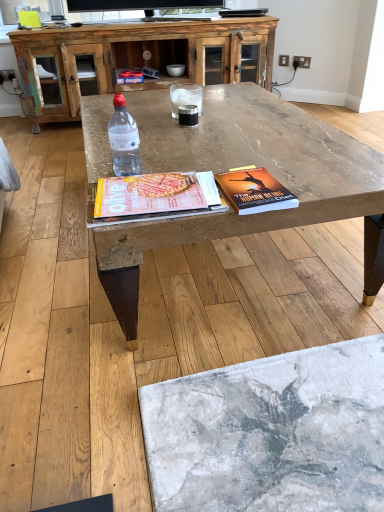
Question: From the image's perspective, does marble textured coffee table at center appear higher than clear glass at center?

Choices:
 (A) no
 (B) yes

Answer: (A)

Question: From a real-world perspective, does marble textured coffee table at center stand above clear glass at center?

Choices:
 (A) no
 (B) yes

Answer: (A)

Question: Is there a large distance between marble textured coffee table at center and clear glass at center?

Choices:
 (A) yes
 (B) no

Answer: (B)

Question: Can you confirm if marble textured coffee table at center is wider than clear glass at center?

Choices:
 (A) yes
 (B) no

Answer: (A)

Question: Is marble textured coffee table at center at the left side of clear glass at center?

Choices:
 (A) no
 (B) yes

Answer: (A)

Question: From a real-world perspective, is black rubberized cup at center physically located above or below transparent plastic bottle at center?

Choices:
 (A) above
 (B) below

Answer: (B)

Question: Does point (196, 123) appear closer or farther from the camera than point (122, 157)?

Choices:
 (A) closer
 (B) farther

Answer: (B)

Question: Is black rubberized cup at center wider or thinner than transparent plastic bottle at center?

Choices:
 (A) wide
 (B) thin

Answer: (A)

Question: Is black rubberized cup at center situated inside transparent plastic bottle at center or outside?

Choices:
 (A) outside
 (B) inside

Answer: (A)

Question: From a real-world perspective, is rustic wood cabinet at upper center physically located above or below hardcover book at center?

Choices:
 (A) above
 (B) below

Answer: (B)

Question: Is rustic wood cabinet at upper center inside the boundaries of hardcover book at center, or outside?

Choices:
 (A) outside
 (B) inside

Answer: (A)

Question: Is point (34, 114) closer or farther from the camera than point (231, 197)?

Choices:
 (A) farther
 (B) closer

Answer: (A)

Question: Looking at their shapes, would you say rustic wood cabinet at upper center is wider or thinner than hardcover book at center?

Choices:
 (A) wide
 (B) thin

Answer: (A)

Question: Is point (236, 194) closer or farther from the camera than point (115, 106)?

Choices:
 (A) closer
 (B) farther

Answer: (A)

Question: Is hardcover book at center spatially inside transparent plastic bottle at center, or outside of it?

Choices:
 (A) outside
 (B) inside

Answer: (A)